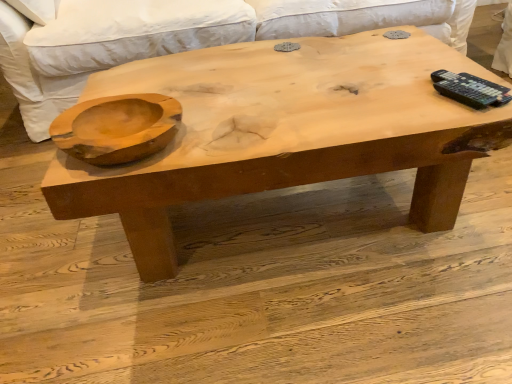
In order to click on vacant area that is situated to the right of natural wood bowl at left in this screenshot , I will do `click(238, 130)`.